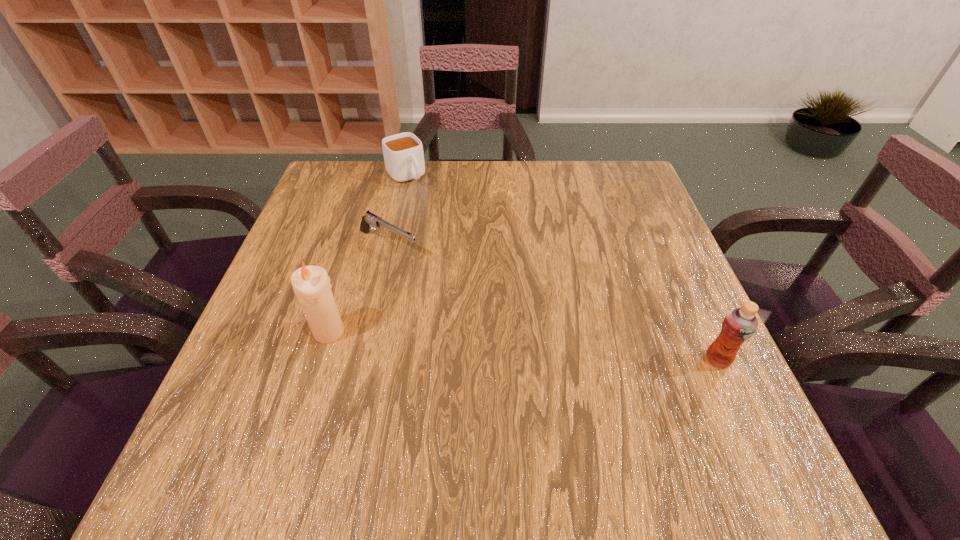
You are a GUI agent. You are given a task and a screenshot of the screen. Output one action in this format:
    pyautogui.click(x=<x>, y=<y>)
    Task: Click on the second nearest object
    
    Given the screenshot: What is the action you would take?
    pyautogui.click(x=311, y=284)

The image size is (960, 540). In order to click on the tallest object in this screenshot , I will do `click(311, 284)`.

I want to click on the second tallest object, so (x=739, y=324).

Identify the location of the nearest object. 739,324.

Identify the location of the shortest object. The width and height of the screenshot is (960, 540). (369, 220).

This screenshot has height=540, width=960. What are the coordinates of `the second farthest object` in the screenshot? It's located at (369, 220).

Locate an element on the screen. the farthest object is located at coordinates (403, 153).

The height and width of the screenshot is (540, 960). What are the coordinates of `cup` in the screenshot? It's located at (403, 153).

The width and height of the screenshot is (960, 540). I want to click on vacant region located on the right of the candle, so click(446, 332).

Locate an element on the screen. free spot located on the left of the orange juice is located at coordinates (592, 360).